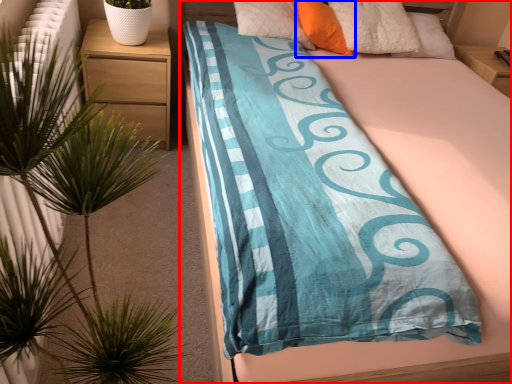
Question: Which object is further to the camera taking this photo, bed (highlighted by a red box) or pillow (highlighted by a blue box)?

Choices:
 (A) bed
 (B) pillow

Answer: (B)